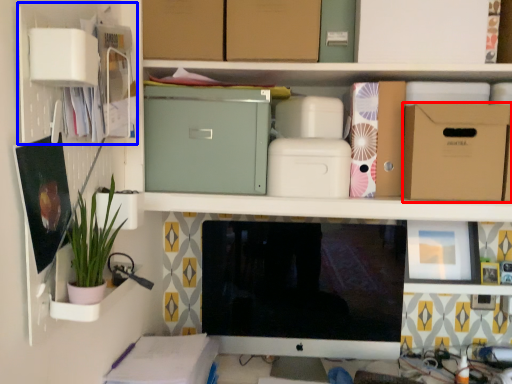
Question: Which point is further to the camera, cardboard box (highlighted by a red box) or cabinet (highlighted by a blue box)?

Choices:
 (A) cardboard box
 (B) cabinet

Answer: (A)